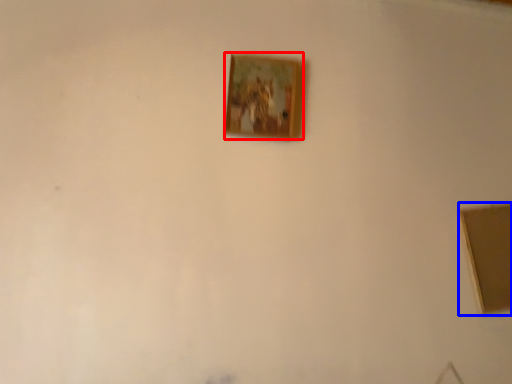
Question: Which point is further to the camera, picture frame (highlighted by a red box) or picture frame (highlighted by a blue box)?

Choices:
 (A) picture frame
 (B) picture frame

Answer: (A)